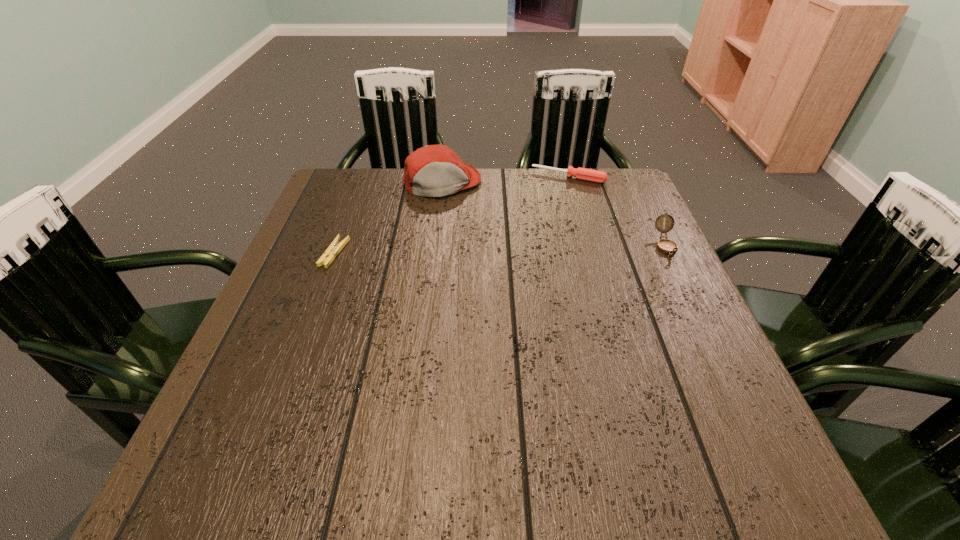
I want to click on screwdriver at the right edge, so click(585, 174).

The image size is (960, 540). Find the location of `object at the far right corner`. object at the far right corner is located at coordinates (585, 174).

This screenshot has height=540, width=960. I want to click on vacant area at the far edge, so click(x=525, y=175).

Locate an element on the screen. The height and width of the screenshot is (540, 960). vacant space at the near edge of the desktop is located at coordinates (348, 396).

Locate an element on the screen. Image resolution: width=960 pixels, height=540 pixels. free space at the right edge is located at coordinates (643, 246).

In the image, there is a desktop. At what (x,y) coordinates should I click in order to perform the action: click on vacant space at the near left corner. Please return your answer as a coordinate pair (x, y). This screenshot has height=540, width=960. Looking at the image, I should click on [x=252, y=410].

This screenshot has height=540, width=960. Identify the location of free point at the far right corner. (605, 171).

In order to click on vacant space at the near right corner of the desktop in this screenshot , I will do `click(674, 422)`.

The image size is (960, 540). In order to click on vacant region between the screwdriver and the tallest object in this screenshot , I will do `click(505, 180)`.

Find the location of a particular element. The image size is (960, 540). empty location between the compass and the leftmost object is located at coordinates (x=500, y=250).